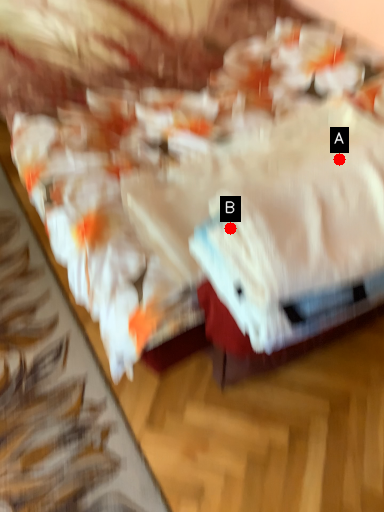
Question: Two points are circled on the image, labeled by A and B beside each circle. Which point is farther to the camera?

Choices:
 (A) A is further
 (B) B is further

Answer: (A)